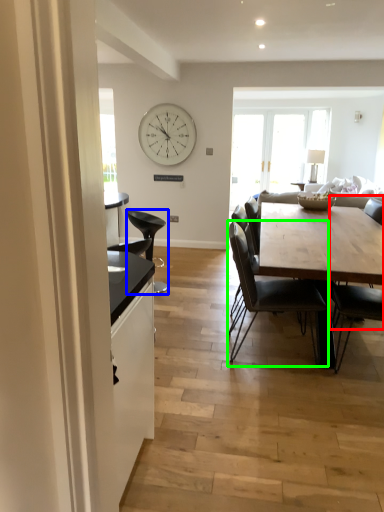
Question: Which object is positioned farthest from chair (highlighted by a red box)? Select from chair (highlighted by a blue box) and chair (highlighted by a green box).

Choices:
 (A) chair
 (B) chair

Answer: (A)